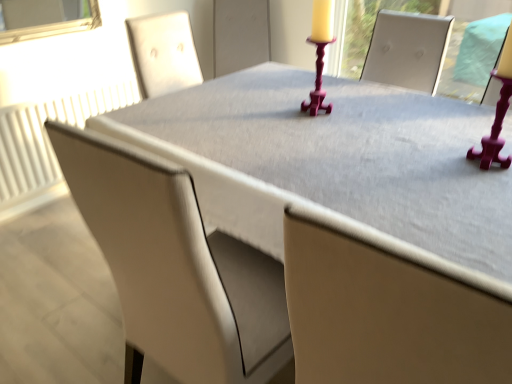
Question: In terms of size, does white textured radiator at left appear bigger or smaller than matte gray table at center?

Choices:
 (A) big
 (B) small

Answer: (B)

Question: Considering their positions, is white textured radiator at left located in front of or behind matte gray table at center?

Choices:
 (A) behind
 (B) front

Answer: (A)

Question: Considering the real-world distances, which object is farthest from the matte gray table at center?

Choices:
 (A) matte beige chair at center
 (B) white textured radiator at left

Answer: (B)

Question: Which of these objects is positioned closest to the white textured radiator at left?

Choices:
 (A) matte beige chair at center
 (B) matte gray table at center

Answer: (B)